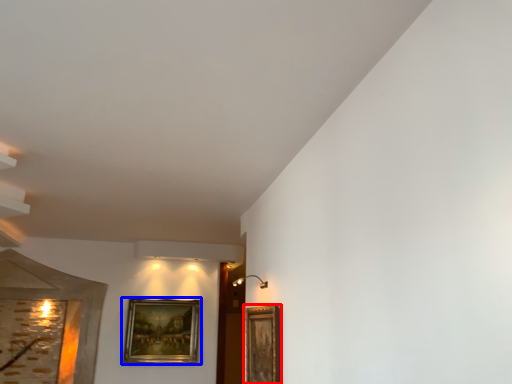
Question: Among these objects, which one is farthest to the camera, picture frame (highlighted by a red box) or picture frame (highlighted by a blue box)?

Choices:
 (A) picture frame
 (B) picture frame

Answer: (B)